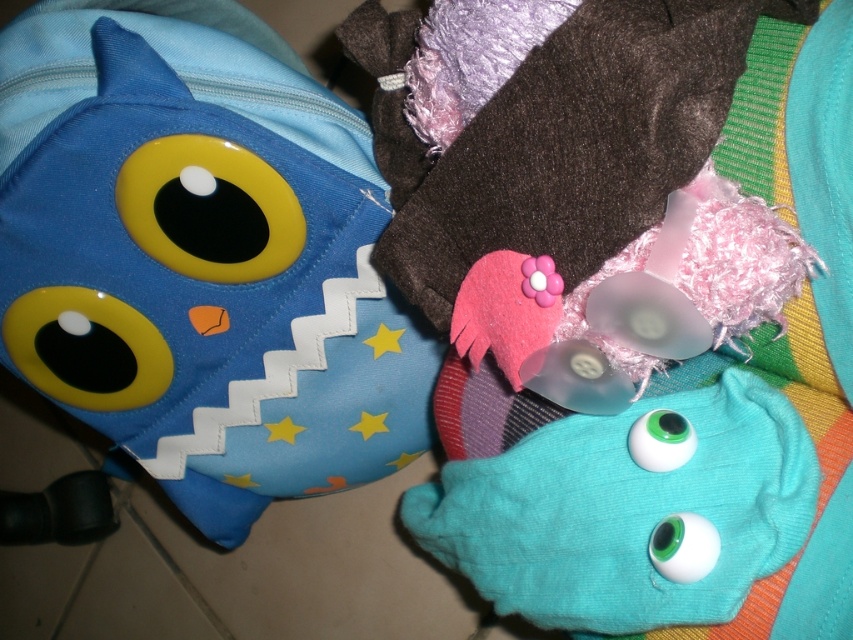
Can you confirm if matte blue plush toy at left is positioned to the left of teal fabric blanket at upper right?

Yes, matte blue plush toy at left is to the left of teal fabric blanket at upper right.

Between matte blue plush toy at left and teal fabric blanket at upper right, which one has less height?

Standing shorter between the two is teal fabric blanket at upper right.

Which is in front, point (119, 401) or point (804, 156)?

Point (804, 156)

Identify the location of matte blue plush toy at left. This screenshot has height=640, width=853. (201, 257).

Does matte blue plush toy at left have a lesser height compared to teal fabric eyes at center?

In fact, matte blue plush toy at left may be taller than teal fabric eyes at center.

Can you confirm if matte blue plush toy at left is positioned to the left of teal fabric eyes at center?

Yes, matte blue plush toy at left is to the left of teal fabric eyes at center.

Is point (194, 168) behind point (546, 576)?

Yes, it is.

This screenshot has height=640, width=853. I want to click on matte blue plush toy at left, so click(x=201, y=257).

Is teal fabric blanket at upper right shorter than teal fabric eyes at center?

No.

The image size is (853, 640). What do you see at coordinates (701, 419) in the screenshot? I see `teal fabric blanket at upper right` at bounding box center [701, 419].

Identify the location of teal fabric blanket at upper right. (701, 419).